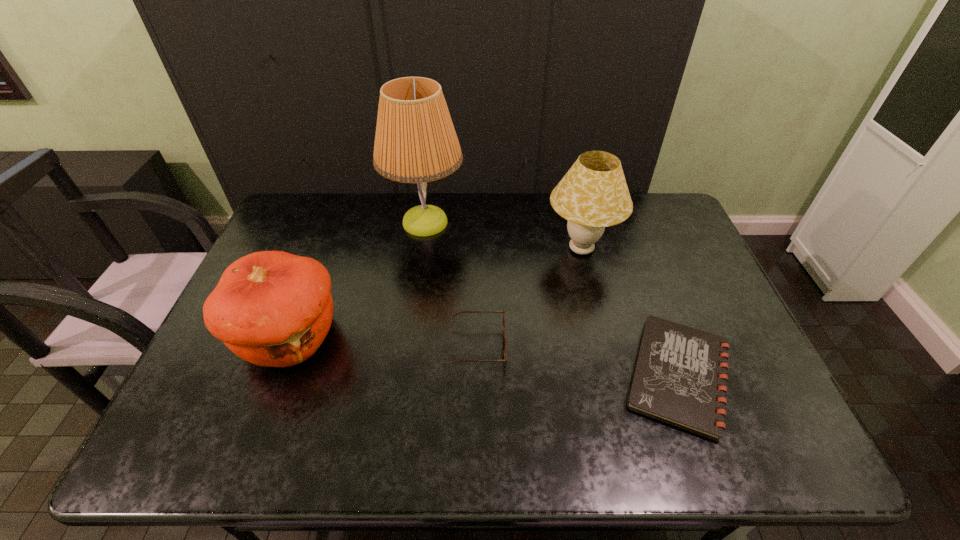
Image resolution: width=960 pixels, height=540 pixels. Find the location of `vacant space located on the left of the notebook`. vacant space located on the left of the notebook is located at coordinates (476, 376).

This screenshot has height=540, width=960. I want to click on lamp that is at the far edge, so click(415, 142).

Where is `lampshade present at the far edge`? This screenshot has height=540, width=960. lampshade present at the far edge is located at coordinates (593, 194).

Locate an element on the screen. The width and height of the screenshot is (960, 540). object present at the near edge is located at coordinates (680, 378).

Locate an element on the screen. The image size is (960, 540). object that is at the left edge is located at coordinates (271, 308).

You are a GUI agent. You are given a task and a screenshot of the screen. Output one action in this format:
    pyautogui.click(x=<x>, y=<y>)
    Task: Click on the object situated at the right edge
    The height and width of the screenshot is (540, 960).
    Given the screenshot: What is the action you would take?
    pyautogui.click(x=680, y=378)

The height and width of the screenshot is (540, 960). What are the coordinates of `object that is at the near right corner` in the screenshot? It's located at (680, 378).

At what (x,y) coordinates should I click in order to perform the action: click on vacant area at the far edge. Please return your answer as a coordinate pair (x, y). The image size is (960, 540). Looking at the image, I should click on (415, 193).

In the image, there is a desktop. Where is `free space at the right edge`? free space at the right edge is located at coordinates (681, 300).

The image size is (960, 540). In order to click on free location at the far left corner of the desktop in this screenshot , I will do `click(317, 197)`.